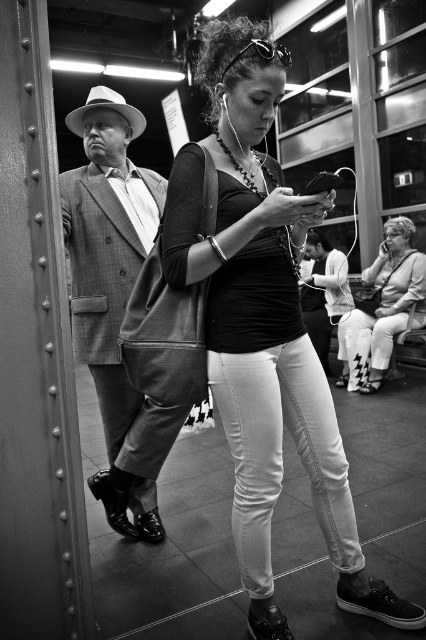
Question: Does plaid wool suit at left appear over white textured pants at lower right?

Choices:
 (A) no
 (B) yes

Answer: (A)

Question: Is matte black shirt at center further to camera compared to plaid wool suit at left?

Choices:
 (A) no
 (B) yes

Answer: (A)

Question: Estimate the real-world distances between objects in this image. Which object is closer to the white textured pants at lower right?

Choices:
 (A) plaid wool suit at left
 (B) matte black shirt at center

Answer: (A)

Question: Which object appears farthest from the camera in this image?

Choices:
 (A) white textured pants at lower right
 (B) matte black shirt at center

Answer: (A)

Question: Does plaid wool suit at left come behind white textured pants at lower right?

Choices:
 (A) yes
 (B) no

Answer: (B)

Question: Which of these objects is positioned farthest from the plaid wool suit at left?

Choices:
 (A) matte black shirt at center
 (B) white textured pants at lower right

Answer: (B)